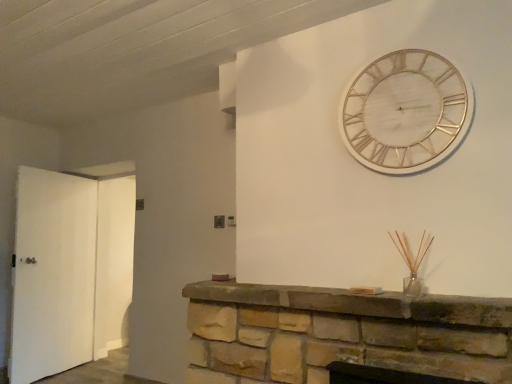
Question: Does white matte door at left, which is counted as the 1th door, starting from the left, have a lesser height compared to white matte door at left, arranged as the second door when viewed from the left?

Choices:
 (A) yes
 (B) no

Answer: (A)

Question: Is white matte door at left, arranged as the second door when viewed from the left, a part of white matte door at left, which is the second door from right to left?

Choices:
 (A) yes
 (B) no

Answer: (B)

Question: Can you confirm if white matte door at left, which is counted as the 1th door, starting from the left, is positioned to the right of white matte door at left, arranged as the second door when viewed from the left?

Choices:
 (A) yes
 (B) no

Answer: (B)

Question: Is white matte door at left, which is counted as the 1th door, starting from the left, positioned in front of white matte door at left, arranged as the second door when viewed from the left?

Choices:
 (A) yes
 (B) no

Answer: (A)

Question: From a real-world perspective, is white matte door at left, which is the second door from right to left, located higher than white matte door at left, arranged as the second door when viewed from the left?

Choices:
 (A) no
 (B) yes

Answer: (A)

Question: Is white matte door at left, arranged as the second door when viewed from the left, in front of or behind brown stone fireplace at center in the image?

Choices:
 (A) behind
 (B) front

Answer: (A)

Question: From their relative heights in the image, would you say white matte door at left, acting as the 1th door starting from the right, is taller or shorter than brown stone fireplace at center?

Choices:
 (A) short
 (B) tall

Answer: (B)

Question: From the image's perspective, relative to brown stone fireplace at center, is white matte door at left, arranged as the second door when viewed from the left, above or below?

Choices:
 (A) above
 (B) below

Answer: (B)

Question: In terms of width, does white matte door at left, arranged as the second door when viewed from the left, look wider or thinner when compared to brown stone fireplace at center?

Choices:
 (A) thin
 (B) wide

Answer: (A)

Question: From the image's perspective, is white wood wall clock at upper right above or below white matte door at left, arranged as the second door when viewed from the left?

Choices:
 (A) below
 (B) above

Answer: (B)

Question: Choose the correct answer: Is white wood wall clock at upper right inside white matte door at left, acting as the 1th door starting from the right, or outside it?

Choices:
 (A) outside
 (B) inside

Answer: (A)

Question: Is white wood wall clock at upper right taller or shorter than white matte door at left, acting as the 1th door starting from the right?

Choices:
 (A) tall
 (B) short

Answer: (B)

Question: In the image, is white wood wall clock at upper right on the left side or the right side of white matte door at left, arranged as the second door when viewed from the left?

Choices:
 (A) right
 (B) left

Answer: (A)

Question: Is brown stone fireplace at center taller or shorter than white matte door at left, acting as the 1th door starting from the right?

Choices:
 (A) tall
 (B) short

Answer: (B)

Question: In terms of size, does brown stone fireplace at center appear bigger or smaller than white matte door at left, arranged as the second door when viewed from the left?

Choices:
 (A) small
 (B) big

Answer: (A)